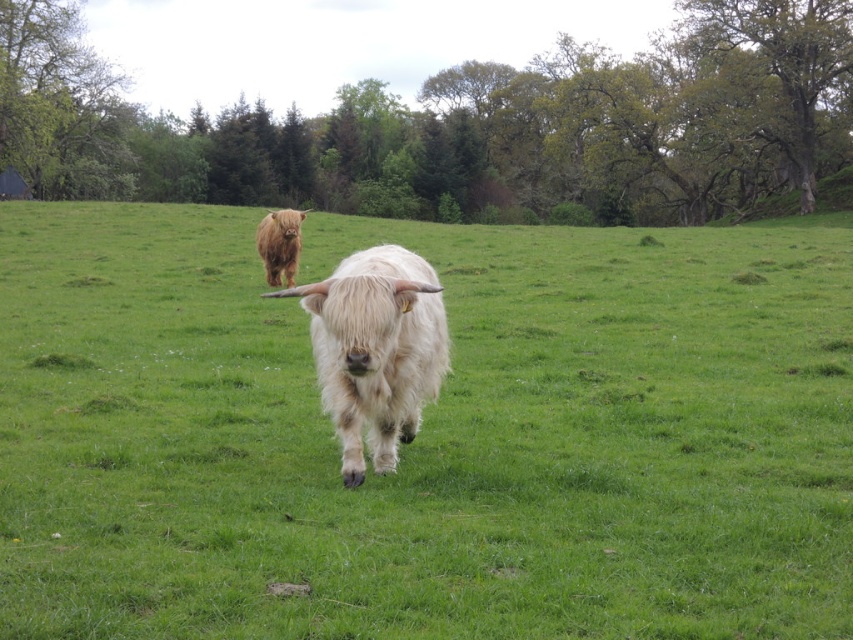
Is point (392, 278) farther from camera compared to point (264, 218)?

No, (392, 278) is closer to viewer.

Can you confirm if white woolly cow at center is positioned below brown fuzzy cow at center?

Indeed, white woolly cow at center is positioned under brown fuzzy cow at center.

The height and width of the screenshot is (640, 853). Identify the location of white woolly cow at center. (375, 349).

Is point (16, 541) positioned behind point (277, 259)?

No, it is not.

Does green grass at center have a smaller size compared to brown fuzzy cow at center?

No, green grass at center is not smaller than brown fuzzy cow at center.

Looking at this image, who is more forward, [669,390] or [277,216]?

Point [669,390]

Where is `green grass at center`? The width and height of the screenshot is (853, 640). green grass at center is located at coordinates (426, 435).

Between green grass at center and white woolly cow at center, which one is positioned lower?

white woolly cow at center is below.

Can you confirm if green grass at center is thinner than white woolly cow at center?

No.

Between point (206, 589) and point (331, 369), which one is positioned in front?

Point (206, 589) is more forward.

This screenshot has height=640, width=853. What are the coordinates of `green grass at center` in the screenshot? It's located at (426, 435).